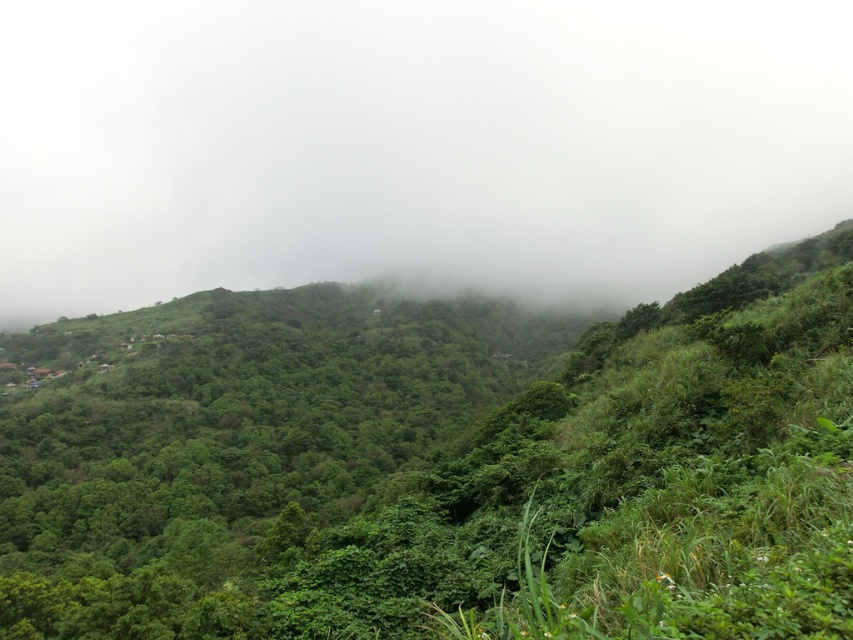
Based on the scene description, which object has a greater thickness between the green leafy vegetation at center and the white foggy cloud at upper center?

The white foggy cloud at upper center is thicker than the green leafy vegetation at center according to the description.

You are a hiker trying to navigate through the green leafy vegetation at center and the white foggy cloud at upper center. Which object is taller?

The green leafy vegetation at center is not as tall as the white foggy cloud at upper center, so the white foggy cloud at upper center is taller.